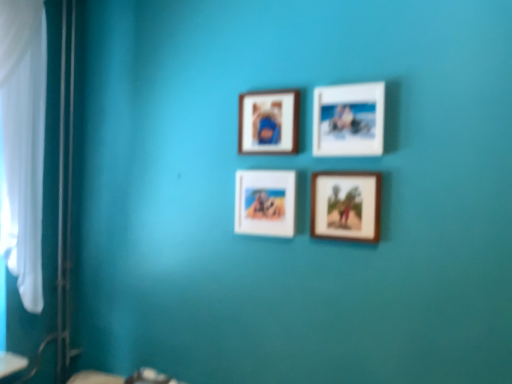
How much space does white matte picture frame at upper center, which is the 1th picture frame from right to left, occupy vertically?

It is 10.54 inches.

Find the location of a particular element. This screenshot has height=384, width=512. matte wooden picture frame at center, which ranks as the 4th picture frame in right-to-left order is located at coordinates (265, 202).

Considering the positions of objects wooden frame at upper center, arranged as the 3th picture frame when viewed from the right, and wooden photo frame at lower right, which is the 3th picture frame in left-to-right order, in the image provided, who is more to the right, wooden frame at upper center, arranged as the 3th picture frame when viewed from the right, or wooden photo frame at lower right, which is the 3th picture frame in left-to-right order,?

wooden photo frame at lower right, which is the 3th picture frame in left-to-right order.

Are wooden frame at upper center, the second picture frame positioned from the left, and wooden photo frame at lower right, the 2th picture frame when ordered from right to left, far apart?

They are positioned close to each other.

Is point (260, 103) farther from camera compared to point (330, 184)?

Yes.

Which is closer to the camera, (337, 87) or (268, 103)?

Point (337, 87) appears to be closer to the viewer than point (268, 103).

Is white matte picture frame at upper center, arranged as the fourth picture frame when viewed from the left, inside or outside of wooden frame at upper center, arranged as the 3th picture frame when viewed from the right?

white matte picture frame at upper center, arranged as the fourth picture frame when viewed from the left, lies outside wooden frame at upper center, arranged as the 3th picture frame when viewed from the right.

Consider the image. Is white matte picture frame at upper center, which is the 1th picture frame from right to left, next to wooden frame at upper center, arranged as the 3th picture frame when viewed from the right?

No, white matte picture frame at upper center, which is the 1th picture frame from right to left, is not touching wooden frame at upper center, arranged as the 3th picture frame when viewed from the right.

Between white matte picture frame at upper center, arranged as the fourth picture frame when viewed from the left, and wooden frame at upper center, arranged as the 3th picture frame when viewed from the right, which one has less height?

With less height is wooden frame at upper center, arranged as the 3th picture frame when viewed from the right.

Looking at this image, which object is positioned more to the left, white matte picture frame at upper center, arranged as the fourth picture frame when viewed from the left, or matte wooden picture frame at center, which ranks as the 4th picture frame in right-to-left order?

From the viewer's perspective, matte wooden picture frame at center, which ranks as the 4th picture frame in right-to-left order, appears more on the left side.

Looking at their sizes, would you say white matte picture frame at upper center, which is the 1th picture frame from right to left, is wider or thinner than matte wooden picture frame at center, which ranks as the first picture frame in left-to-right order?

Considering their sizes, white matte picture frame at upper center, which is the 1th picture frame from right to left, looks broader than matte wooden picture frame at center, which ranks as the first picture frame in left-to-right order.

Can you confirm if white matte picture frame at upper center, arranged as the fourth picture frame when viewed from the left, is smaller than matte wooden picture frame at center, which ranks as the first picture frame in left-to-right order?

No, white matte picture frame at upper center, arranged as the fourth picture frame when viewed from the left, is not smaller than matte wooden picture frame at center, which ranks as the first picture frame in left-to-right order.

Can matte wooden picture frame at center, which ranks as the 4th picture frame in right-to-left order, be found inside white matte picture frame at upper center, which is the 1th picture frame from right to left?

No, matte wooden picture frame at center, which ranks as the 4th picture frame in right-to-left order, is not inside white matte picture frame at upper center, which is the 1th picture frame from right to left.

From the image's perspective, starting from the wooden photo frame at lower right, which is the 3th picture frame in left-to-right order, which picture frame is the 1st one above? Please provide its 2D coordinates.

[(265, 202)]

Is matte wooden picture frame at center, which ranks as the first picture frame in left-to-right order, oriented towards wooden photo frame at lower right, which is the 3th picture frame in left-to-right order?

No, matte wooden picture frame at center, which ranks as the first picture frame in left-to-right order, does not turn towards wooden photo frame at lower right, which is the 3th picture frame in left-to-right order.

Does point (274, 229) come farther from viewer compared to point (321, 202)?

Yes.

From the image's perspective, count 1st picture frames downward from the white matte picture frame at upper center, which is the 1th picture frame from right to left, and point to it. Please provide its 2D coordinates.

[(265, 202)]

Is matte wooden picture frame at center, which ranks as the first picture frame in left-to-right order, oriented away from white matte picture frame at upper center, which is the 1th picture frame from right to left?

matte wooden picture frame at center, which ranks as the first picture frame in left-to-right order, is not turned away from white matte picture frame at upper center, which is the 1th picture frame from right to left.

Who is bigger, matte wooden picture frame at center, which ranks as the first picture frame in left-to-right order, or white matte picture frame at upper center, arranged as the fourth picture frame when viewed from the left?

white matte picture frame at upper center, arranged as the fourth picture frame when viewed from the left, is bigger.

Is wooden photo frame at lower right, which is the 3th picture frame in left-to-right order, facing away from white matte picture frame at upper center, which is the 1th picture frame from right to left?

That's not correct — wooden photo frame at lower right, which is the 3th picture frame in left-to-right order, is not looking away from white matte picture frame at upper center, which is the 1th picture frame from right to left.

Considering the sizes of wooden photo frame at lower right, which is the 3th picture frame in left-to-right order, and white matte picture frame at upper center, which is the 1th picture frame from right to left, in the image, is wooden photo frame at lower right, which is the 3th picture frame in left-to-right order, wider or thinner than white matte picture frame at upper center, which is the 1th picture frame from right to left,?

Considering their sizes, wooden photo frame at lower right, which is the 3th picture frame in left-to-right order, looks slimmer than white matte picture frame at upper center, which is the 1th picture frame from right to left.

Is point (365, 217) positioned after point (328, 137)?

No.

I want to click on picture frame that is on the right side of wooden photo frame at lower right, which is the 3th picture frame in left-to-right order, so click(349, 120).

Is wooden frame at upper center, the second picture frame positioned from the left, oriented towards white matte picture frame at upper center, arranged as the fourth picture frame when viewed from the left?

No, wooden frame at upper center, the second picture frame positioned from the left, is not turned towards white matte picture frame at upper center, arranged as the fourth picture frame when viewed from the left.

From a real-world perspective, relative to white matte picture frame at upper center, which is the 1th picture frame from right to left, is wooden frame at upper center, the second picture frame positioned from the left, vertically above or below?

From a real-world perspective, wooden frame at upper center, the second picture frame positioned from the left, is physically below white matte picture frame at upper center, which is the 1th picture frame from right to left.

Based on the photo, is wooden frame at upper center, the second picture frame positioned from the left, completely or partially outside of white matte picture frame at upper center, which is the 1th picture frame from right to left?

Absolutely, wooden frame at upper center, the second picture frame positioned from the left, is external to white matte picture frame at upper center, which is the 1th picture frame from right to left.

Where is `picture frame that is the 3rd object located above the wooden photo frame at lower right, which is the 3th picture frame in left-to-right order (from the image's perspective)`? The height and width of the screenshot is (384, 512). picture frame that is the 3rd object located above the wooden photo frame at lower right, which is the 3th picture frame in left-to-right order (from the image's perspective) is located at coordinates (268, 122).

Where is `picture frame above the wooden frame at upper center, arranged as the 3th picture frame when viewed from the right (from a real-world perspective)`? picture frame above the wooden frame at upper center, arranged as the 3th picture frame when viewed from the right (from a real-world perspective) is located at coordinates (349, 120).

Estimate the real-world distances between objects in this image. Which object is closer to matte wooden picture frame at center, which ranks as the first picture frame in left-to-right order, wooden frame at upper center, the second picture frame positioned from the left, or white matte picture frame at upper center, which is the 1th picture frame from right to left?

wooden frame at upper center, the second picture frame positioned from the left, is closer to matte wooden picture frame at center, which ranks as the first picture frame in left-to-right order.

When comparing their distances from wooden frame at upper center, arranged as the 3th picture frame when viewed from the right, does wooden photo frame at lower right, the 2th picture frame when ordered from right to left, or white matte picture frame at upper center, which is the 1th picture frame from right to left, seem further?

The object further to wooden frame at upper center, arranged as the 3th picture frame when viewed from the right, is wooden photo frame at lower right, the 2th picture frame when ordered from right to left.

Which object lies further to the anchor point white matte picture frame at upper center, arranged as the fourth picture frame when viewed from the left, wooden photo frame at lower right, which is the 3th picture frame in left-to-right order, or wooden frame at upper center, the second picture frame positioned from the left?

wooden frame at upper center, the second picture frame positioned from the left, is further to white matte picture frame at upper center, arranged as the fourth picture frame when viewed from the left.

In the scene shown: Considering their positions, is wooden photo frame at lower right, which is the 3th picture frame in left-to-right order, positioned further to matte wooden picture frame at center, which ranks as the first picture frame in left-to-right order, than wooden frame at upper center, the second picture frame positioned from the left?

wooden frame at upper center, the second picture frame positioned from the left, is further to matte wooden picture frame at center, which ranks as the first picture frame in left-to-right order.

Looking at the image, which one is located further to wooden photo frame at lower right, which is the 3th picture frame in left-to-right order, matte wooden picture frame at center, which ranks as the 4th picture frame in right-to-left order, or wooden frame at upper center, arranged as the 3th picture frame when viewed from the right?

The object further to wooden photo frame at lower right, which is the 3th picture frame in left-to-right order, is wooden frame at upper center, arranged as the 3th picture frame when viewed from the right.

Based on their spatial positions, is matte wooden picture frame at center, which ranks as the first picture frame in left-to-right order, or wooden photo frame at lower right, the 2th picture frame when ordered from right to left, further from white matte picture frame at upper center, which is the 1th picture frame from right to left?

matte wooden picture frame at center, which ranks as the first picture frame in left-to-right order, lies further to white matte picture frame at upper center, which is the 1th picture frame from right to left, than the other object.

Considering their positions, is wooden frame at upper center, arranged as the 3th picture frame when viewed from the right, positioned closer to white matte picture frame at upper center, which is the 1th picture frame from right to left, than matte wooden picture frame at center, which ranks as the 4th picture frame in right-to-left order?

The object closer to white matte picture frame at upper center, which is the 1th picture frame from right to left, is wooden frame at upper center, arranged as the 3th picture frame when viewed from the right.

Based on their spatial positions, is white matte picture frame at upper center, arranged as the fourth picture frame when viewed from the left, or wooden photo frame at lower right, the 2th picture frame when ordered from right to left, closer to wooden frame at upper center, arranged as the 3th picture frame when viewed from the right?

white matte picture frame at upper center, arranged as the fourth picture frame when viewed from the left, is positioned closer to the anchor wooden frame at upper center, arranged as the 3th picture frame when viewed from the right.

Where is `picture frame between wooden frame at upper center, arranged as the 3th picture frame when viewed from the right, and matte wooden picture frame at center, which ranks as the 4th picture frame in right-to-left order, vertically`? picture frame between wooden frame at upper center, arranged as the 3th picture frame when viewed from the right, and matte wooden picture frame at center, which ranks as the 4th picture frame in right-to-left order, vertically is located at coordinates (349, 120).

Image resolution: width=512 pixels, height=384 pixels. Identify the location of picture frame between white matte picture frame at upper center, which is the 1th picture frame from right to left, and wooden photo frame at lower right, the 2th picture frame when ordered from right to left, in the vertical direction. (265, 202).